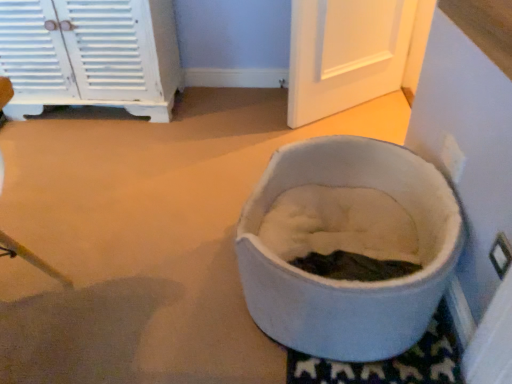
Locate an element on the screen. The height and width of the screenshot is (384, 512). white painted wood cabinet at upper left is located at coordinates (91, 54).

What do you see at coordinates (91, 54) in the screenshot?
I see `white painted wood cabinet at upper left` at bounding box center [91, 54].

This screenshot has width=512, height=384. In order to click on white soft pet bed at center in this screenshot , I will do `click(348, 281)`.

This screenshot has width=512, height=384. What do you see at coordinates (348, 281) in the screenshot?
I see `white soft pet bed at center` at bounding box center [348, 281].

The image size is (512, 384). I want to click on white painted wood cabinet at upper left, so click(x=91, y=54).

Is white painted wood cabinet at upper left at the left side of white soft pet bed at center?

Indeed, white painted wood cabinet at upper left is positioned on the left side of white soft pet bed at center.

Which object is closer to the camera taking this photo, white painted wood cabinet at upper left or white soft pet bed at center?

white soft pet bed at center is in front.

Does point (119, 45) come farther from viewer compared to point (462, 224)?

Yes, it is.

From the image's perspective, is white painted wood cabinet at upper left over white soft pet bed at center?

Yes, from the image's perspective, white painted wood cabinet at upper left is over white soft pet bed at center.

From a real-world perspective, is white painted wood cabinet at upper left under white soft pet bed at center?

No, from a real-world perspective, white painted wood cabinet at upper left is not below white soft pet bed at center.

Does white painted wood cabinet at upper left have a greater width compared to white soft pet bed at center?

In fact, white painted wood cabinet at upper left might be narrower than white soft pet bed at center.

Considering the sizes of white painted wood cabinet at upper left and white soft pet bed at center in the image, is white painted wood cabinet at upper left taller or shorter than white soft pet bed at center?

white painted wood cabinet at upper left is taller than white soft pet bed at center.

Does white painted wood cabinet at upper left have a smaller size compared to white soft pet bed at center?

Actually, white painted wood cabinet at upper left might be larger than white soft pet bed at center.

Can white soft pet bed at center be found inside white painted wood cabinet at upper left?

No, white soft pet bed at center is located outside of white painted wood cabinet at upper left.

Is white painted wood cabinet at upper left in contact with white soft pet bed at center?

No, white painted wood cabinet at upper left is not beside white soft pet bed at center.

Is white painted wood cabinet at upper left looking in the opposite direction of white soft pet bed at center?

That's not correct — white painted wood cabinet at upper left is not looking away from white soft pet bed at center.

Can you tell me how much white painted wood cabinet at upper left and white soft pet bed at center differ in facing direction?

The facing directions of white painted wood cabinet at upper left and white soft pet bed at center are 92.9 degrees apart.

I want to click on toilet directly beneath the white painted wood cabinet at upper left (from a real-world perspective), so [348, 281].

Is white soft pet bed at center to the right of white painted wood cabinet at upper left from the viewer's perspective?

Yes.

Is the depth of white soft pet bed at center greater than that of white painted wood cabinet at upper left?

No, white soft pet bed at center is closer to the camera.

Considering the points (422, 199) and (23, 102), which point is behind, point (422, 199) or point (23, 102)?

The point (23, 102) is farther.

Looking at this image, from the image's perspective, is white soft pet bed at center on top of white painted wood cabinet at upper left?

No, from the image's perspective, white soft pet bed at center is not on top of white painted wood cabinet at upper left.

From a real-world perspective, is white soft pet bed at center under white painted wood cabinet at upper left?

Yes, from a real-world perspective, white soft pet bed at center is under white painted wood cabinet at upper left.

Can you confirm if white soft pet bed at center is wider than white painted wood cabinet at upper left?

Yes, white soft pet bed at center is wider than white painted wood cabinet at upper left.

In the scene shown: In terms of height, does white soft pet bed at center look taller or shorter compared to white painted wood cabinet at upper left?

Considering their sizes, white soft pet bed at center has less height than white painted wood cabinet at upper left.

Considering the relative sizes of white soft pet bed at center and white painted wood cabinet at upper left in the image provided, is white soft pet bed at center bigger than white painted wood cabinet at upper left?

Actually, white soft pet bed at center might be smaller than white painted wood cabinet at upper left.

Is white soft pet bed at center not within white painted wood cabinet at upper left?

Yes.

Is the surface of white soft pet bed at center in direct contact with white painted wood cabinet at upper left?

No, white soft pet bed at center is not next to white painted wood cabinet at upper left.

Could you tell me if white soft pet bed at center is facing white painted wood cabinet at upper left?

No, white soft pet bed at center does not turn towards white painted wood cabinet at upper left.

How different are the orientations of white soft pet bed at center and white painted wood cabinet at upper left in degrees?

92.9 degrees separate the facing orientations of white soft pet bed at center and white painted wood cabinet at upper left.

How distant is white soft pet bed at center from white painted wood cabinet at upper left?

They are 1.22 meters apart.

This screenshot has height=384, width=512. What are the coordinates of `toilet on the right of white painted wood cabinet at upper left` in the screenshot? It's located at (348, 281).

Where is `toilet in front of the white painted wood cabinet at upper left`? toilet in front of the white painted wood cabinet at upper left is located at coordinates (348, 281).

Image resolution: width=512 pixels, height=384 pixels. Find the location of `toilet located on the right of white painted wood cabinet at upper left`. toilet located on the right of white painted wood cabinet at upper left is located at coordinates (348, 281).